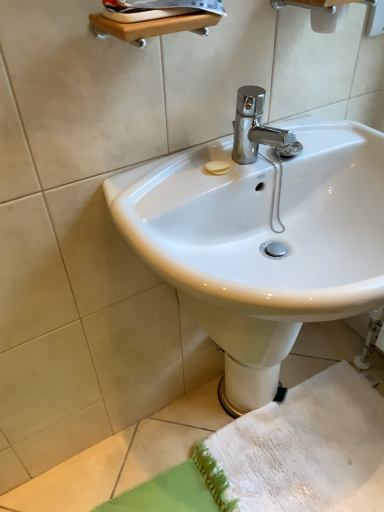
Question: Is white glossy sink at center aimed at white textured towel at lower right?

Choices:
 (A) no
 (B) yes

Answer: (A)

Question: Is white glossy sink at center at the right side of white textured towel at lower right?

Choices:
 (A) no
 (B) yes

Answer: (A)

Question: Is white glossy sink at center completely or partially outside of white textured towel at lower right?

Choices:
 (A) no
 (B) yes

Answer: (B)

Question: From the image's perspective, is white glossy sink at center located beneath white textured towel at lower right?

Choices:
 (A) no
 (B) yes

Answer: (A)

Question: Is white glossy sink at center touching white textured towel at lower right?

Choices:
 (A) yes
 (B) no

Answer: (B)

Question: In terms of width, does white glossy bidet at lower center look wider or thinner when compared to white glossy sink at center?

Choices:
 (A) wide
 (B) thin

Answer: (B)

Question: Is point (251, 336) positioned closer to the camera than point (195, 316)?

Choices:
 (A) closer
 (B) farther

Answer: (A)

Question: Do you think white glossy bidet at lower center is within white glossy sink at center, or outside of it?

Choices:
 (A) outside
 (B) inside

Answer: (A)

Question: From the image's perspective, is white glossy bidet at lower center located above or below white glossy sink at center?

Choices:
 (A) above
 (B) below

Answer: (B)

Question: Considering the positions of white glossy bidet at lower center and white textured towel at lower right in the image, is white glossy bidet at lower center wider or thinner than white textured towel at lower right?

Choices:
 (A) thin
 (B) wide

Answer: (A)

Question: Would you say white glossy bidet at lower center is to the left or to the right of white textured towel at lower right in the picture?

Choices:
 (A) right
 (B) left

Answer: (B)

Question: Is point (236, 411) positioned closer to the camera than point (243, 439)?

Choices:
 (A) closer
 (B) farther

Answer: (B)

Question: Is white glossy bidet at lower center in front of or behind white textured towel at lower right in the image?

Choices:
 (A) front
 (B) behind

Answer: (B)

Question: Would you say white glossy sink at center is to the left or to the right of white textured towel at lower right in the picture?

Choices:
 (A) left
 (B) right

Answer: (A)

Question: Is white glossy sink at center bigger or smaller than white textured towel at lower right?

Choices:
 (A) big
 (B) small

Answer: (A)